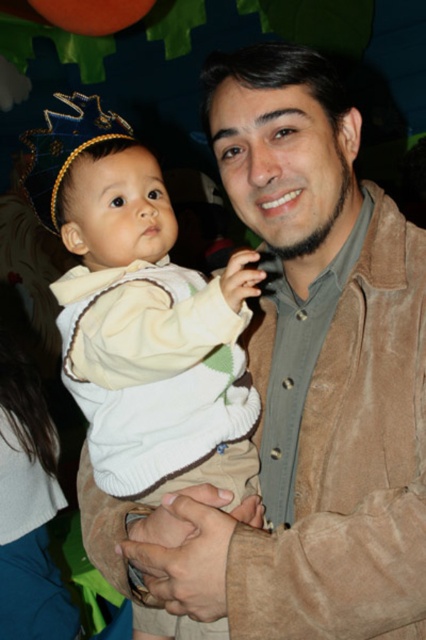
Question: From the image, what is the correct spatial relationship of white fleece sweater at center in relation to blue fabric crown at upper left?

Choices:
 (A) above
 (B) below

Answer: (B)

Question: From the image, what is the correct spatial relationship of suede jacket at center in relation to white fleece sweater at center?

Choices:
 (A) below
 (B) above

Answer: (A)

Question: Which is nearer to the suede jacket at center?

Choices:
 (A) white fleece sweater at center
 (B) blue fabric crown at upper left

Answer: (A)

Question: Which point is closer to the camera?

Choices:
 (A) blue fabric crown at upper left
 (B) suede jacket at center
 (C) white fleece sweater at center

Answer: (B)

Question: Does suede jacket at center have a larger size compared to white fleece sweater at center?

Choices:
 (A) yes
 (B) no

Answer: (A)

Question: Which of these objects is positioned farthest from the white fleece sweater at center?

Choices:
 (A) suede jacket at center
 (B) blue fabric crown at upper left

Answer: (B)